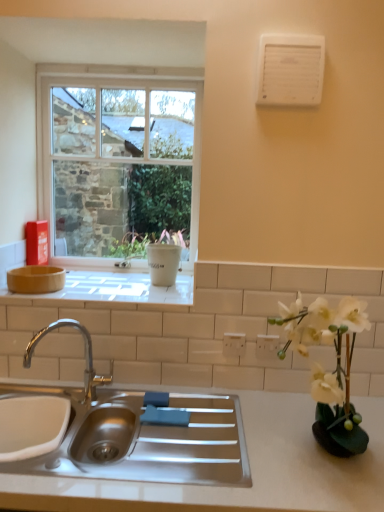
Locate an element on the screen. This screenshot has height=512, width=384. vacant space underneath white matte vase at right (from a real-world perspective) is located at coordinates (323, 468).